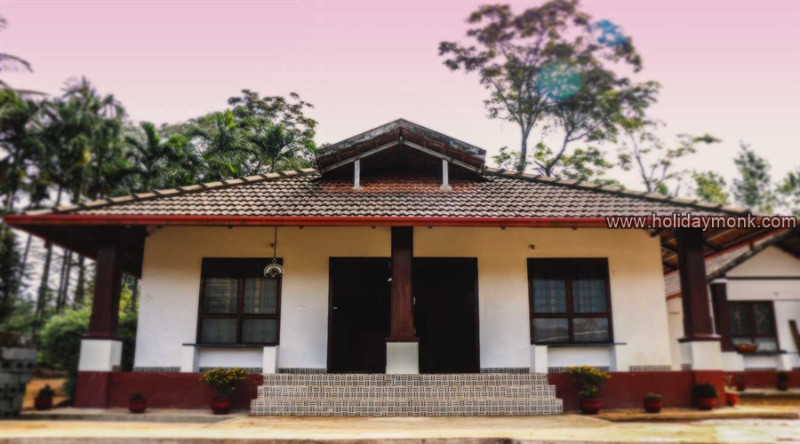
I want to click on white wall, so click(x=490, y=295).